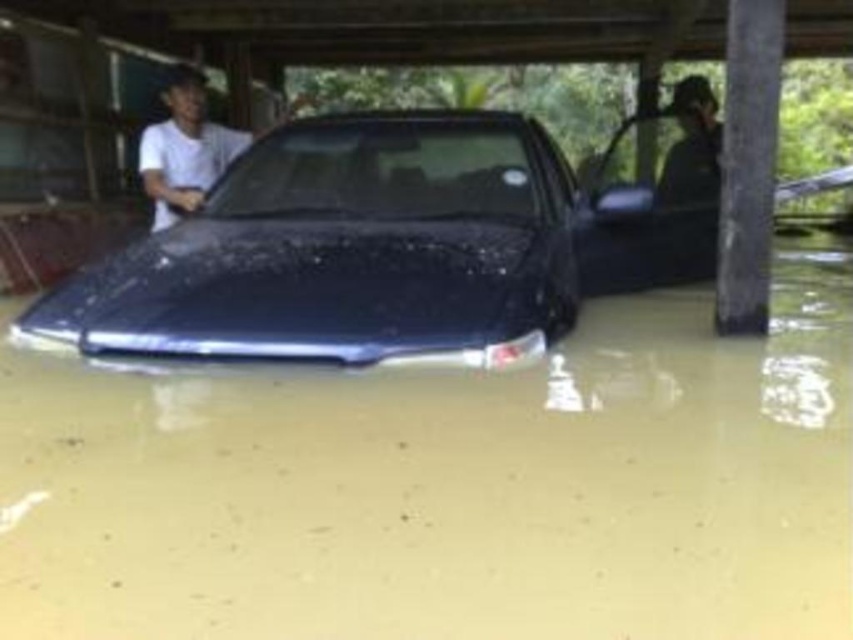
Question: Is clear water at car front wider than white matte shirt at center?

Choices:
 (A) yes
 (B) no

Answer: (A)

Question: Which point appears closest to the camera in this image?

Choices:
 (A) (192, 122)
 (B) (415, 381)

Answer: (B)

Question: Which point is farther to the camera?

Choices:
 (A) white matte shirt at center
 (B) clear water at car front

Answer: (A)

Question: Does clear water at car front have a greater width compared to white matte shirt at center?

Choices:
 (A) no
 (B) yes

Answer: (B)

Question: Considering the relative positions of clear water at car front and white matte shirt at center in the image provided, where is clear water at car front located with respect to white matte shirt at center?

Choices:
 (A) above
 (B) below

Answer: (B)